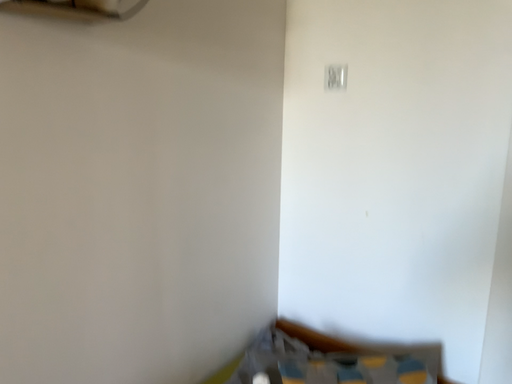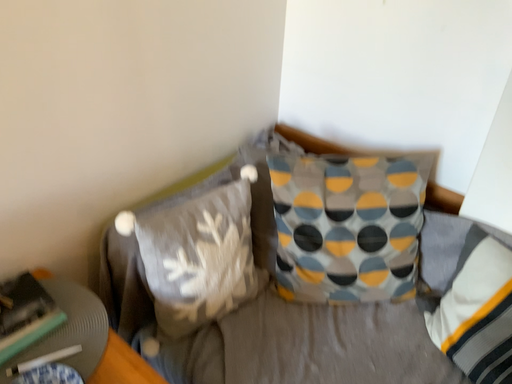
Question: How did the camera likely rotate when shooting the video?

Choices:
 (A) rotated upward
 (B) rotated downward

Answer: (B)